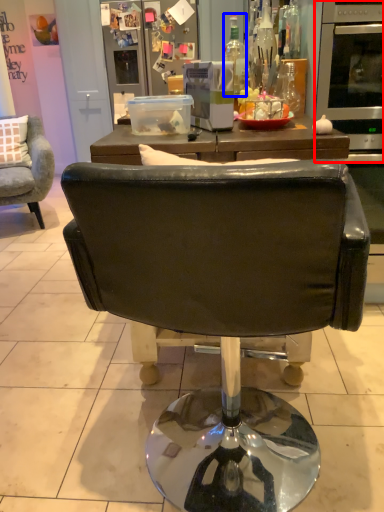
Question: Which point is closer to the camera, oven (highlighted by a red box) or bottle (highlighted by a blue box)?

Choices:
 (A) oven
 (B) bottle

Answer: (A)